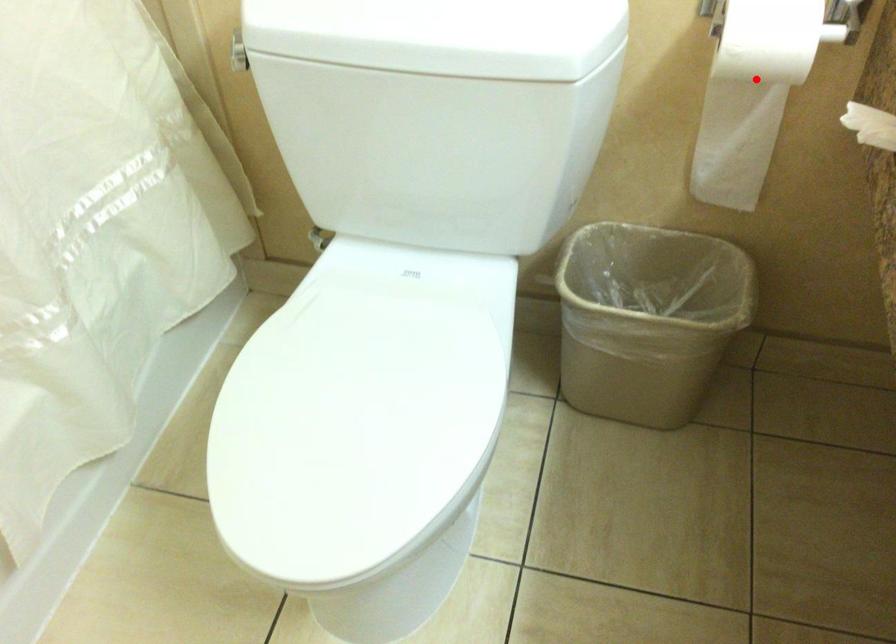
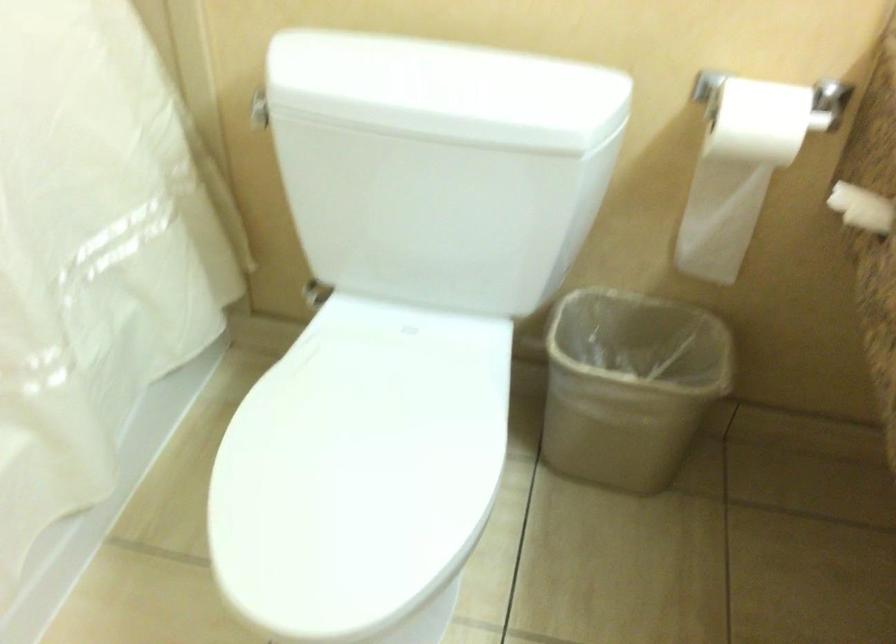
Question: A red point is marked in image1. In image2, is the corresponding 3D point closer to the camera or farther? Reply with the corresponding letter.

Choices:
 (A) The corresponding 3D point is closer.
 (B) The corresponding 3D point is farther.

Answer: (B)